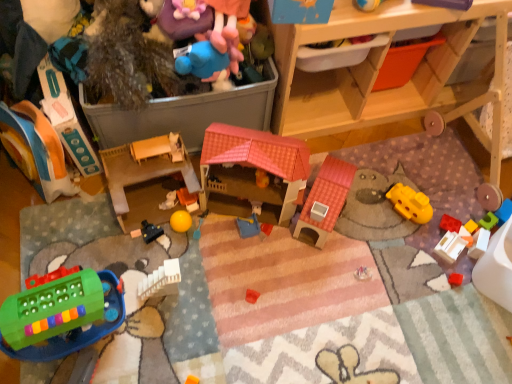
I want to click on free space in front of matte plastic toy at left, positioned as the 13th toy in right-to-left order, so pyautogui.click(x=41, y=227).